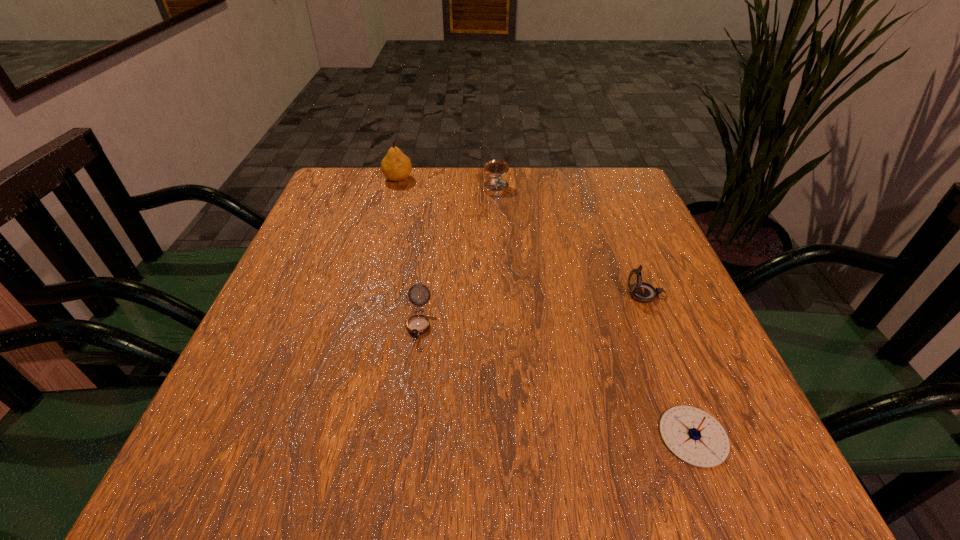
This screenshot has width=960, height=540. In the image, there is a desktop. What are the coordinates of `vacant region at the far left corner` in the screenshot? It's located at (348, 213).

This screenshot has height=540, width=960. Find the location of `free space at the near left corner of the desktop`. free space at the near left corner of the desktop is located at coordinates (262, 441).

Identify the location of vacant space at the far right corner of the desktop. (598, 194).

I want to click on empty space between the tallest object and the fourth object from right to left, so click(x=409, y=251).

Locate an element on the screen. free spot between the fourth object from right to left and the tallest object is located at coordinates (409, 251).

The height and width of the screenshot is (540, 960). Find the location of `free point between the nearest object and the leftmost object`. free point between the nearest object and the leftmost object is located at coordinates (545, 308).

I want to click on vacant area that lies between the pear and the leftmost compass, so click(x=409, y=251).

Locate an element on the screen. free space between the leftmost object and the farthest compass is located at coordinates (447, 185).

Identify the location of unoccupied area between the leftmost object and the third object from right to left. (447, 185).

In order to click on free spot between the leftmost compass and the tallest object in this screenshot , I will do `click(409, 251)`.